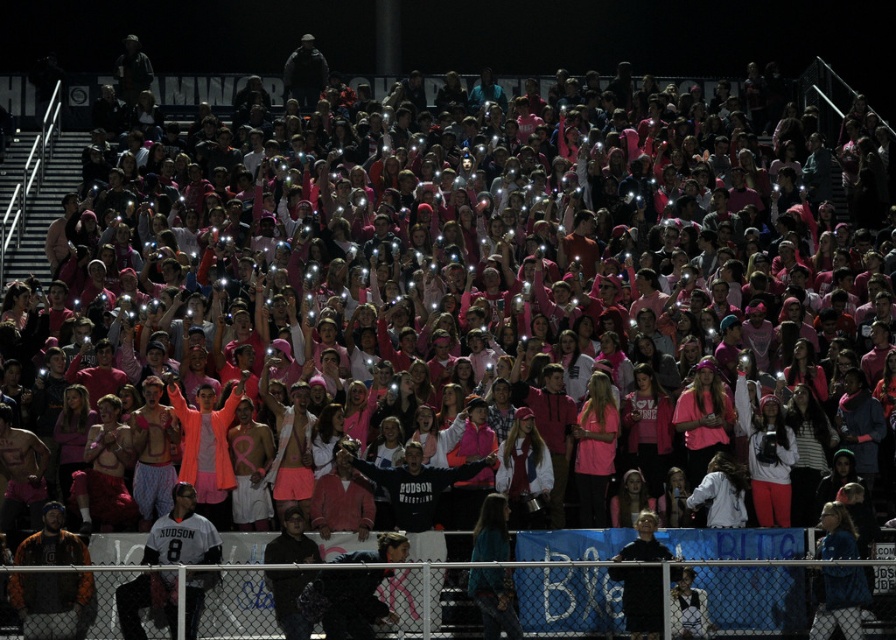
You are a photographer positioned at the front row of the stadium. You want to take a photo of both the white jersey at lower left and the black matte jacket at lower center. Which object should you focus on first to ensure both are in sharp focus?

You should focus on the white jersey at lower left first because it is closer to the viewer than the black matte jacket at lower center. By focusing on the closer object, the farther one will still be within the depth of field, ensuring both are in focus.

You are a photographer standing behind the chain link fence in the foreground. You want to take a photo of both the white jersey at lower left and the orange leather jacket at lower left. Which object should you focus on first if you want to ensure both are in the frame without moving the camera?

You should focus on the orange leather jacket at lower left first because it is taller than the white jersey at lower left, ensuring both will fit within the frame when centered on the taller object.

You are standing at the center of the field and see the point marked at coordinates (182, 532). Which object is located at that point?

The point at coordinates (182, 532) marks the white jersey at lower left.